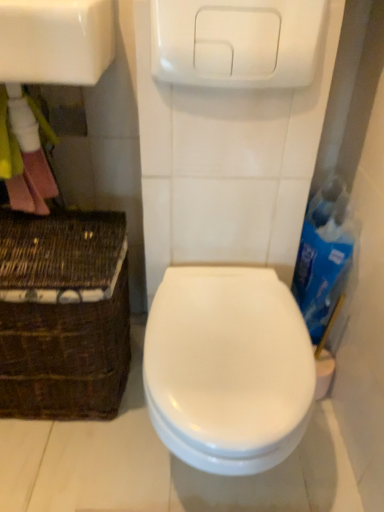
Question: From a real-world perspective, is white glossy sink at upper left positioned above or below brown woven basket at lower left?

Choices:
 (A) below
 (B) above

Answer: (B)

Question: Would you say white glossy sink at upper left is to the left or to the right of brown woven basket at lower left in the picture?

Choices:
 (A) left
 (B) right

Answer: (B)

Question: Estimate the real-world distances between objects in this image. Which object is farther from the brown woven basket at lower left?

Choices:
 (A) white glossy sink at upper left
 (B) white glossy toilet at center
 (C) blue cardboard box at right

Answer: (C)

Question: Estimate the real-world distances between objects in this image. Which object is closer to the white glossy toilet at center?

Choices:
 (A) white glossy sink at upper left
 (B) blue cardboard box at right
 (C) brown woven basket at lower left

Answer: (C)